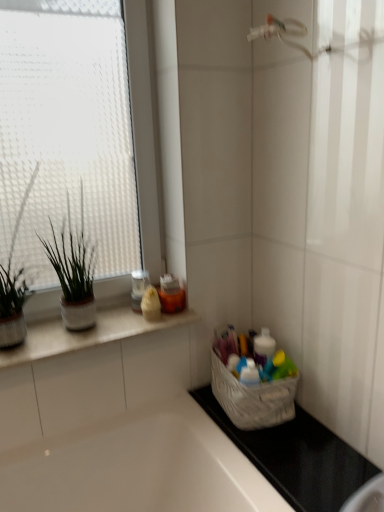
Image resolution: width=384 pixels, height=512 pixels. Identify the location of free location in front of white fabric basket at lower right. (284, 451).